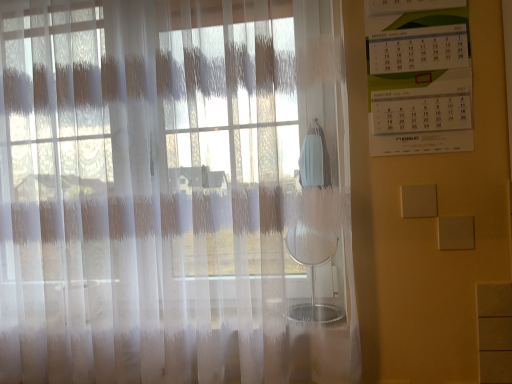
Question: From the image's perspective, is translucent white curtain at left positioned above or below white paper calendar at upper right?

Choices:
 (A) above
 (B) below

Answer: (B)

Question: Is translucent white curtain at left wider or thinner than white paper calendar at upper right?

Choices:
 (A) wide
 (B) thin

Answer: (A)

Question: In terms of size, does translucent white curtain at left appear bigger or smaller than white paper calendar at upper right?

Choices:
 (A) small
 (B) big

Answer: (B)

Question: Looking at their shapes, would you say white paper calendar at upper right is wider or thinner than translucent white curtain at left?

Choices:
 (A) wide
 (B) thin

Answer: (B)

Question: Would you say white paper calendar at upper right is inside or outside translucent white curtain at left?

Choices:
 (A) inside
 (B) outside

Answer: (B)

Question: Based on their positions, is white paper calendar at upper right located to the left or right of translucent white curtain at left?

Choices:
 (A) right
 (B) left

Answer: (A)

Question: From the image's perspective, is white paper calendar at upper right located above or below translucent white curtain at left?

Choices:
 (A) below
 (B) above

Answer: (B)